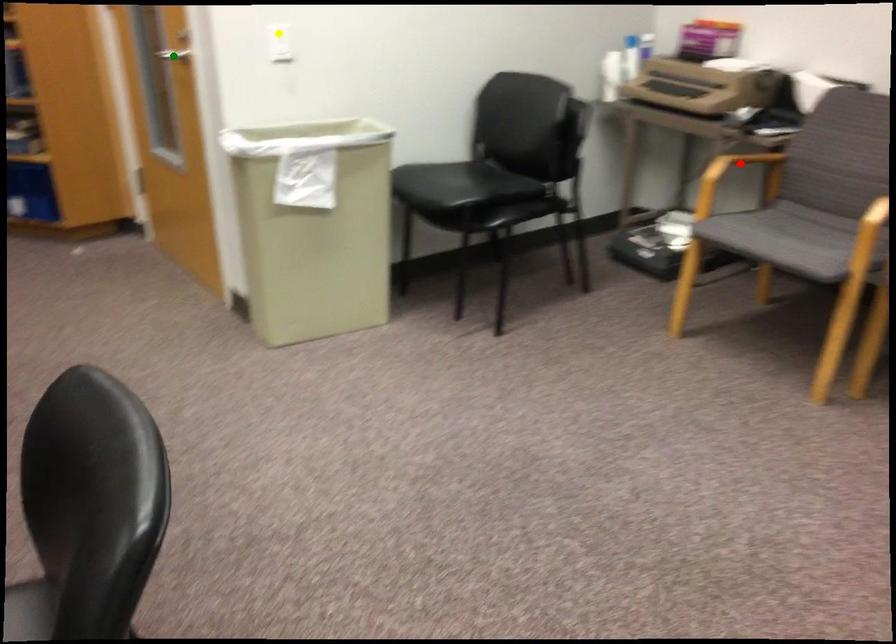
Order these from nearest to farthest:
red point | green point | yellow point

yellow point
green point
red point